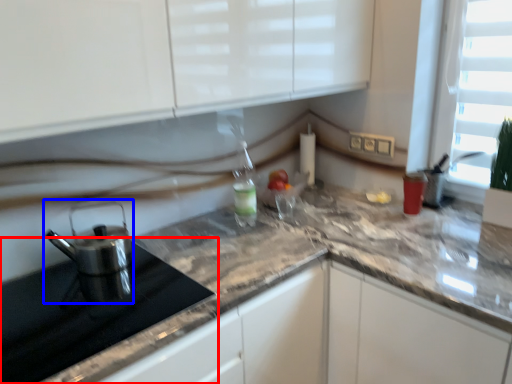
Question: Which object is further to the camera taking this photo, appliance (highlighted by a red box) or kitchen appliance (highlighted by a blue box)?

Choices:
 (A) appliance
 (B) kitchen appliance

Answer: (B)